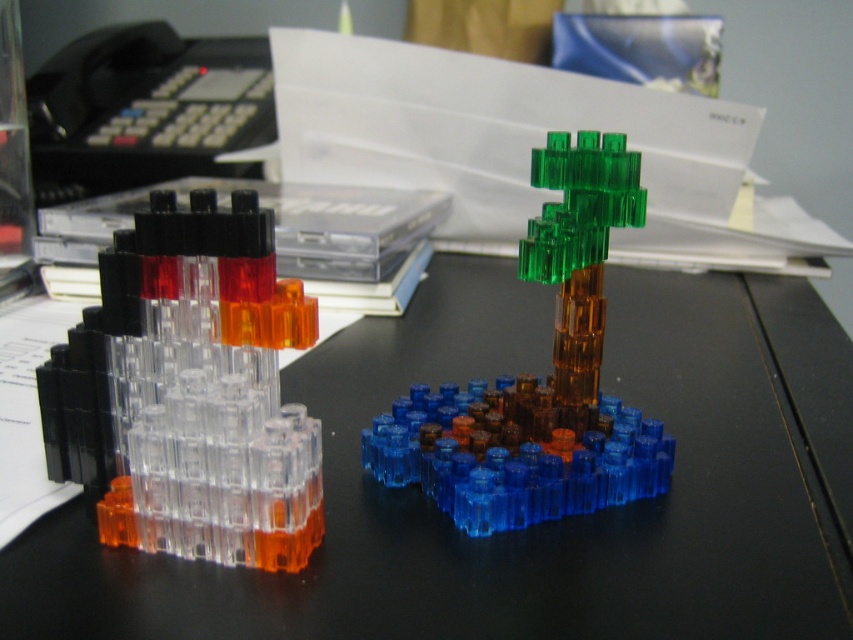
How far apart are transparent plastic blocks at center and transparent plastic tree at center?

A distance of 6.99 inches exists between transparent plastic blocks at center and transparent plastic tree at center.

Image resolution: width=853 pixels, height=640 pixels. What do you see at coordinates (541, 524) in the screenshot?
I see `transparent plastic blocks at center` at bounding box center [541, 524].

What are the coordinates of `transparent plastic blocks at center` in the screenshot? It's located at (541, 524).

Based on the photo, who is positioned more to the left, transparent plastic rocket at left or transparent plastic tree at center?

transparent plastic rocket at left

Who is lower down, transparent plastic rocket at left or transparent plastic tree at center?

Positioned lower is transparent plastic rocket at left.

What do you see at coordinates (190, 392) in the screenshot? I see `transparent plastic rocket at left` at bounding box center [190, 392].

Where is `transparent plastic rocket at left`? Image resolution: width=853 pixels, height=640 pixels. transparent plastic rocket at left is located at coordinates (190, 392).

Is point (35, 547) farther from camera compared to point (106, 440)?

No, it is not.

Can you confirm if transparent plastic blocks at center is positioned to the left of transparent plastic rocket at left?

Incorrect, transparent plastic blocks at center is not on the left side of transparent plastic rocket at left.

Which is in front, point (341, 356) or point (268, 276)?

Point (268, 276) is in front.

At what (x,y) coordinates should I click in order to perform the action: click on transparent plastic blocks at center. Please return your answer as a coordinate pair (x, y). The image size is (853, 640). Looking at the image, I should click on (541, 524).